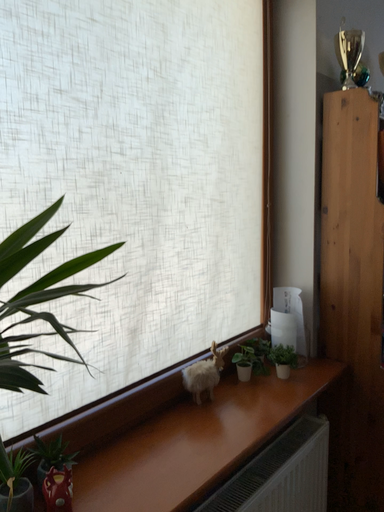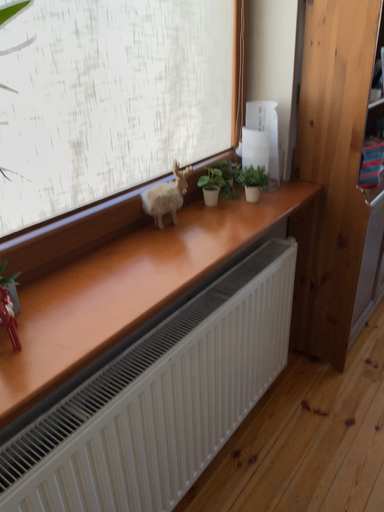
Question: How did the camera likely rotate when shooting the video?

Choices:
 (A) rotated upward
 (B) rotated downward

Answer: (B)